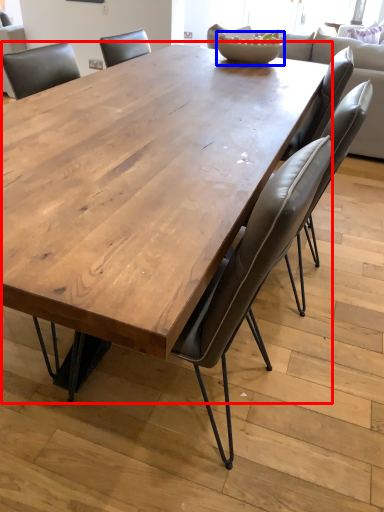
Question: Which object is closer to the camera taking this photo, coffee table (highlighted by a red box) or bowl (highlighted by a blue box)?

Choices:
 (A) coffee table
 (B) bowl

Answer: (A)